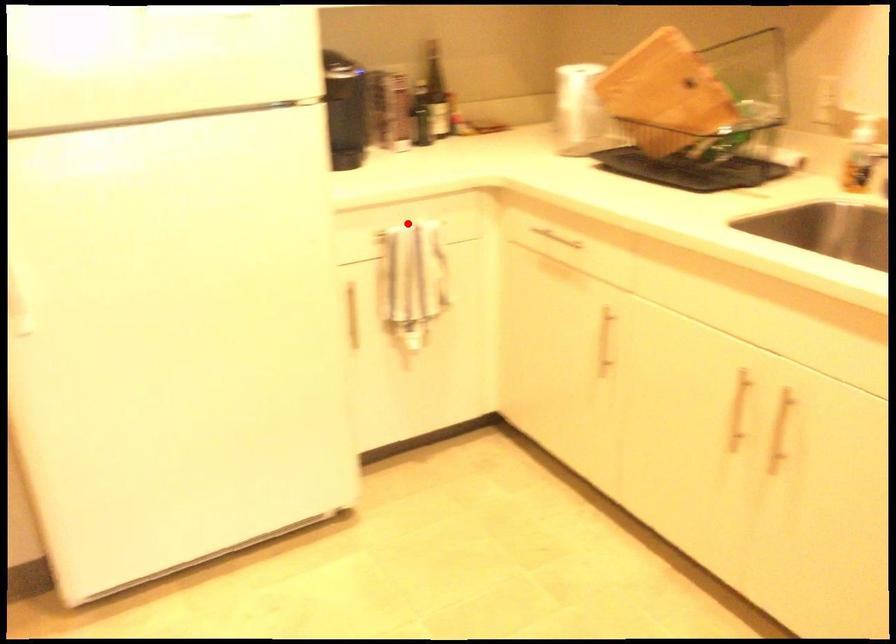
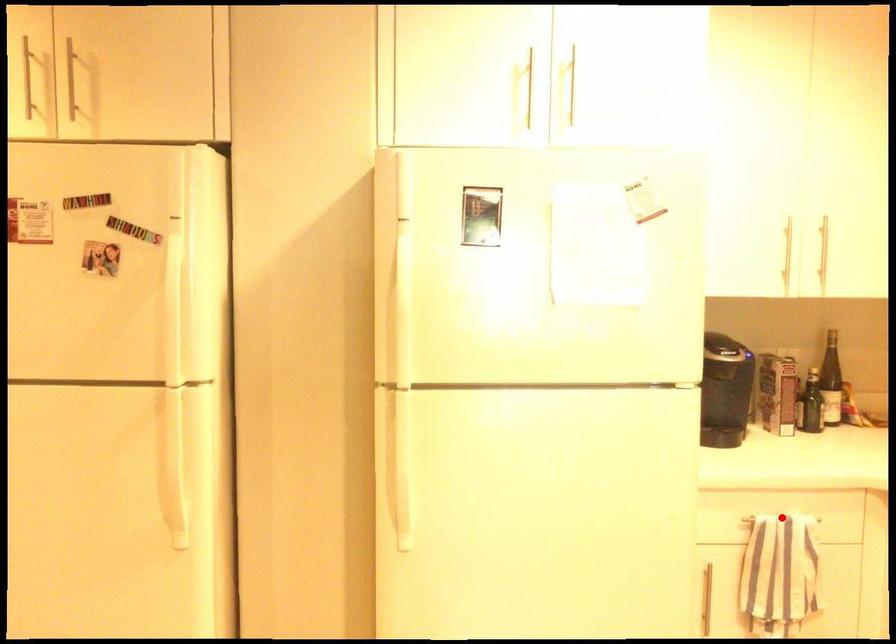
I am providing you with two images of the same scene from different viewpoints. A red point is marked on the first image and another point is marked on the second image. Is the red point in image1 aligned with the point shown in image2?

Yes